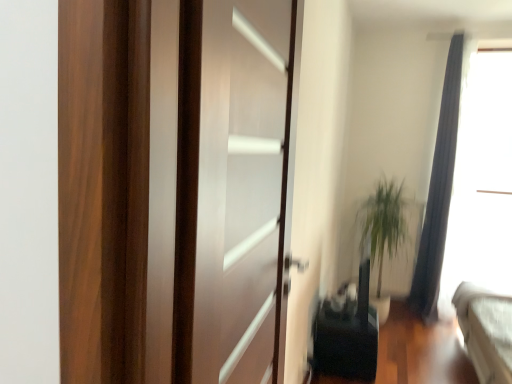
Question: Is the depth of transparent glass door at center greater than that of silky gray curtain at right?

Choices:
 (A) yes
 (B) no

Answer: (B)

Question: From a real-world perspective, is transparent glass door at center beneath silky gray curtain at right?

Choices:
 (A) no
 (B) yes

Answer: (A)

Question: Can you confirm if transparent glass door at center is shorter than silky gray curtain at right?

Choices:
 (A) yes
 (B) no

Answer: (A)

Question: Can you confirm if transparent glass door at center is positioned to the left of silky gray curtain at right?

Choices:
 (A) yes
 (B) no

Answer: (A)

Question: Are transparent glass door at center and silky gray curtain at right located far from each other?

Choices:
 (A) no
 (B) yes

Answer: (B)

Question: From a real-world perspective, is green leafy plant at right positioned above or below transparent glass door at center?

Choices:
 (A) above
 (B) below

Answer: (B)

Question: Is green leafy plant at right in front of or behind transparent glass door at center in the image?

Choices:
 (A) behind
 (B) front

Answer: (A)

Question: Choose the correct answer: Is green leafy plant at right inside transparent glass door at center or outside it?

Choices:
 (A) inside
 (B) outside

Answer: (B)

Question: In terms of size, does green leafy plant at right appear bigger or smaller than transparent glass door at center?

Choices:
 (A) big
 (B) small

Answer: (B)

Question: In the image, is green leafy plant at right positioned in front of or behind silky gray curtain at right?

Choices:
 (A) behind
 (B) front

Answer: (A)

Question: From their relative heights in the image, would you say green leafy plant at right is taller or shorter than silky gray curtain at right?

Choices:
 (A) tall
 (B) short

Answer: (B)

Question: Does point (360, 215) appear closer or farther from the camera than point (456, 107)?

Choices:
 (A) farther
 (B) closer

Answer: (A)

Question: Considering the positions of green leafy plant at right and silky gray curtain at right in the image, is green leafy plant at right bigger or smaller than silky gray curtain at right?

Choices:
 (A) small
 (B) big

Answer: (A)

Question: Is green leafy plant at right wider or thinner than transparent glass window screen at upper right?

Choices:
 (A) wide
 (B) thin

Answer: (B)

Question: Is point (373, 263) positioned closer to the camera than point (441, 269)?

Choices:
 (A) closer
 (B) farther

Answer: (A)